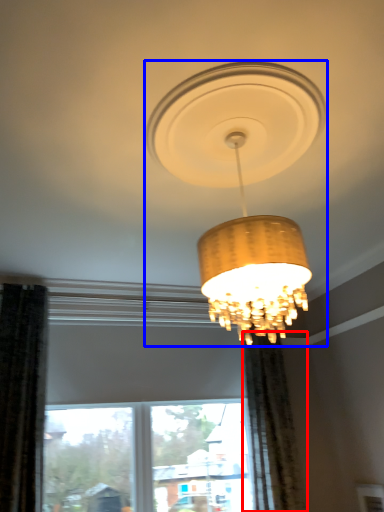
Question: Which of the following is the closest to the observer, curtain (highlighted by a red box) or lamp (highlighted by a blue box)?

Choices:
 (A) curtain
 (B) lamp

Answer: (B)